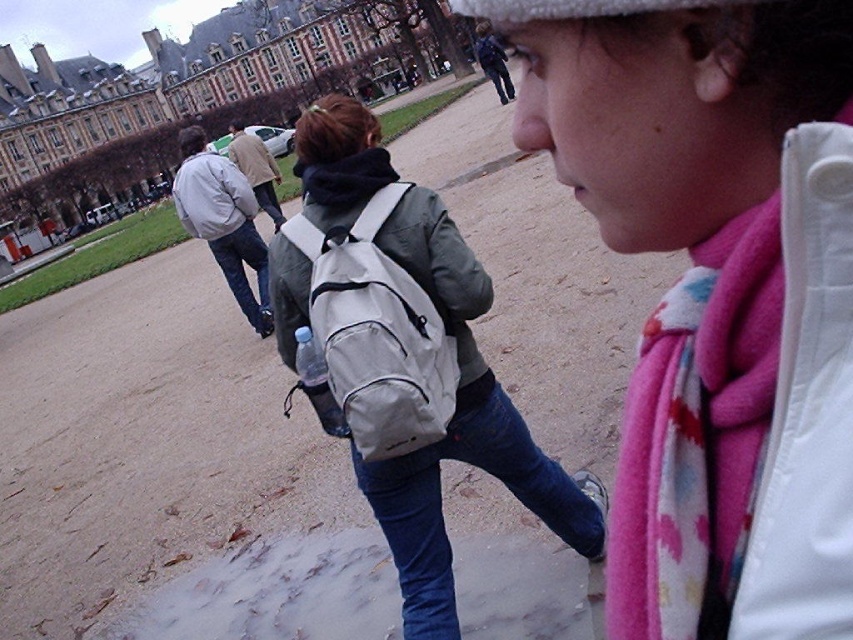
Question: Among these points, which one is nearest to the camera?

Choices:
 (A) (242, 253)
 (B) (505, 248)
 (C) (405, 628)
 (D) (312, 228)

Answer: (C)

Question: Does brown stone building at upper left appear under matte gray jacket at center?

Choices:
 (A) yes
 (B) no

Answer: (B)

Question: Which point is farther to the camera?

Choices:
 (A) (839, 276)
 (B) (242, 256)
 (C) (421, 576)

Answer: (B)

Question: Considering the relative positions of dirt field at center and matte gray jacket at center in the image provided, where is dirt field at center located with respect to matte gray jacket at center?

Choices:
 (A) below
 (B) above

Answer: (A)

Question: Which point is closer to the camera?

Choices:
 (A) (194, 433)
 (B) (625, 497)

Answer: (B)

Question: Is matte gray backpack at center closer to the viewer compared to light gray backpack at center?

Choices:
 (A) no
 (B) yes

Answer: (B)